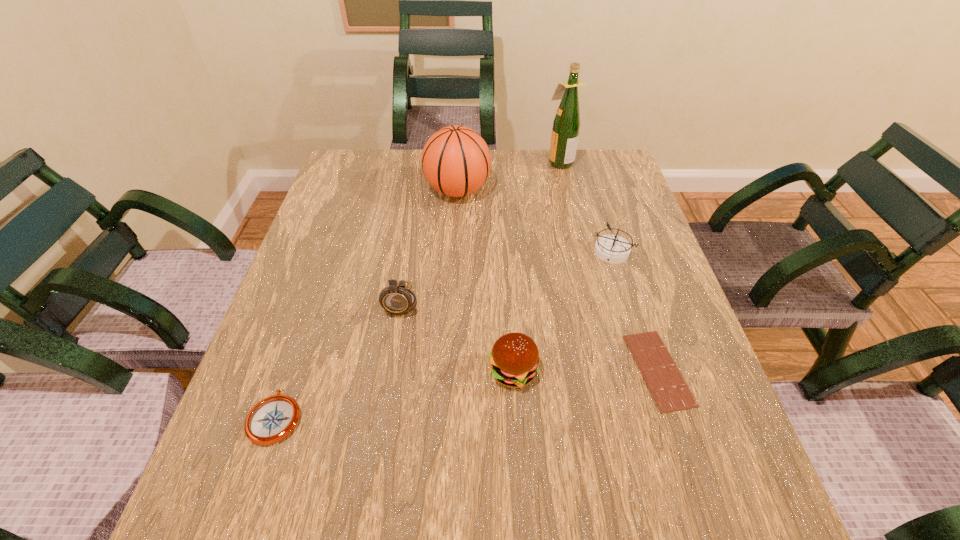
Image resolution: width=960 pixels, height=540 pixels. I want to click on vacant space in between the tallest compass and the farthest object, so click(x=480, y=231).

Locate an element on the screen. This screenshot has width=960, height=540. free space between the sixth shortest object and the second nearest compass is located at coordinates (429, 245).

Where is `free area in between the liquor and the nearest compass`? free area in between the liquor and the nearest compass is located at coordinates (418, 289).

Identify the location of the fifth closest object to the third shortest object. Image resolution: width=960 pixels, height=540 pixels. (397, 300).

The width and height of the screenshot is (960, 540). Find the location of `object that can be found as the second closest to the hamburger`. object that can be found as the second closest to the hamburger is located at coordinates (670, 391).

Locate which compass ranks in proximity to the leftmost object. Please provide its 2D coordinates. Your answer should be formatted as a tuple, i.e. [(x, y)], where the tuple contains the x and y coordinates of a point satisfying the conditions above.

[(397, 300)]

At what (x,y) coordinates should I click in order to perform the action: click on compass object that ranks as the closest to the fifth nearest object. Please return your answer as a coordinate pair (x, y). Looking at the image, I should click on (397, 300).

The width and height of the screenshot is (960, 540). What are the coordinates of `free space that satisfies the following two spatial constraints: 1. on the front-facing side of the tallest object; 2. on the left side of the chocolate bar` in the screenshot? It's located at (608, 370).

Where is `free space that satisfies the following two spatial constraints: 1. on the front side of the rightmost compass; 2. on the right side of the shortest object`? The width and height of the screenshot is (960, 540). free space that satisfies the following two spatial constraints: 1. on the front side of the rightmost compass; 2. on the right side of the shortest object is located at coordinates (649, 370).

Identify the location of free point that satisfies the following two spatial constraints: 1. on the front-facing side of the tallest object; 2. on the left side of the fifth nearest object. (581, 252).